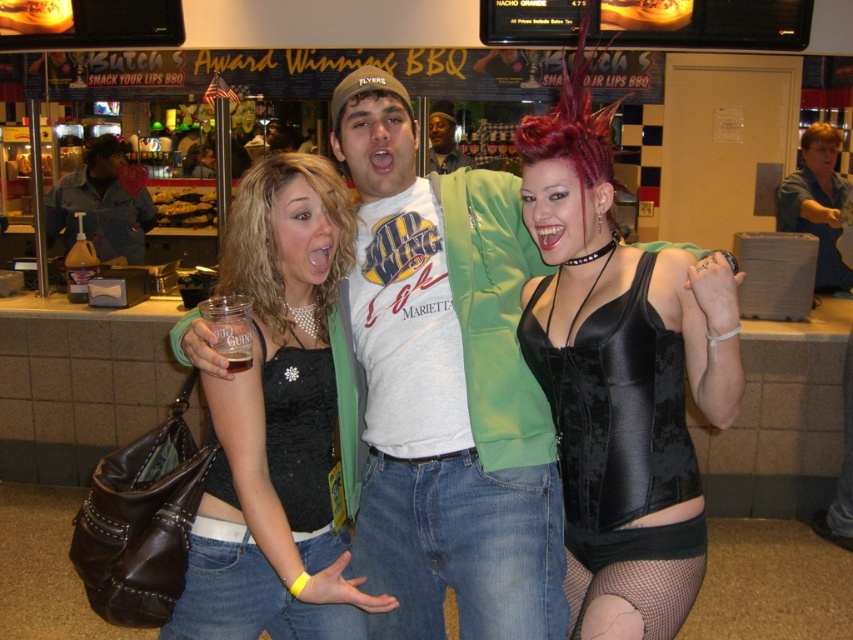
Question: Which point appears closest to the camera in this image?

Choices:
 (A) 227,369
 (B) 790,182
 (C) 611,440
 (D) 332,483

Answer: (A)

Question: Can you confirm if shiny black corset at center is thinner than denim jacket at left?

Choices:
 (A) no
 (B) yes

Answer: (B)

Question: Among these points, which one is farthest from the camera?

Choices:
 (A) (229, 371)
 (B) (605, 305)
 (C) (526, 493)

Answer: (C)

Question: Among these points, which one is farthest from the camera?

Choices:
 (A) (605, 416)
 (B) (648, 492)

Answer: (A)

Question: Is matte white shirt at center wider than translucent plastic cup at center?

Choices:
 (A) no
 (B) yes

Answer: (B)

Question: Does matte black tank top at center appear under matte white shirt at center?

Choices:
 (A) no
 (B) yes

Answer: (B)